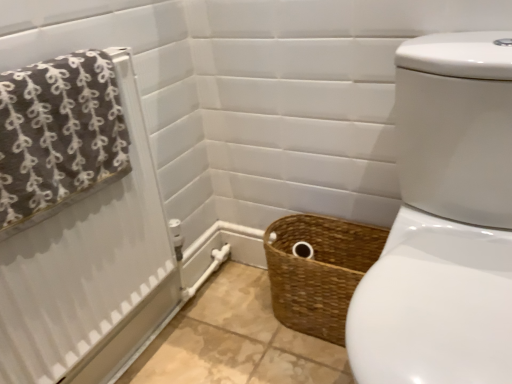
Question: Is brown woven basket at lower center inside or outside of brown textured towel at left?

Choices:
 (A) inside
 (B) outside

Answer: (B)

Question: Considering the positions of brown woven basket at lower center and brown textured towel at left in the image, is brown woven basket at lower center bigger or smaller than brown textured towel at left?

Choices:
 (A) big
 (B) small

Answer: (A)

Question: Which is farther from the brown textured towel at left?

Choices:
 (A) brown fabric towel at upper left
 (B) brown woven basket at lower center

Answer: (B)

Question: Which object is positioned farthest from the brown textured towel at left?

Choices:
 (A) brown woven basket at lower center
 (B) brown fabric towel at upper left

Answer: (A)